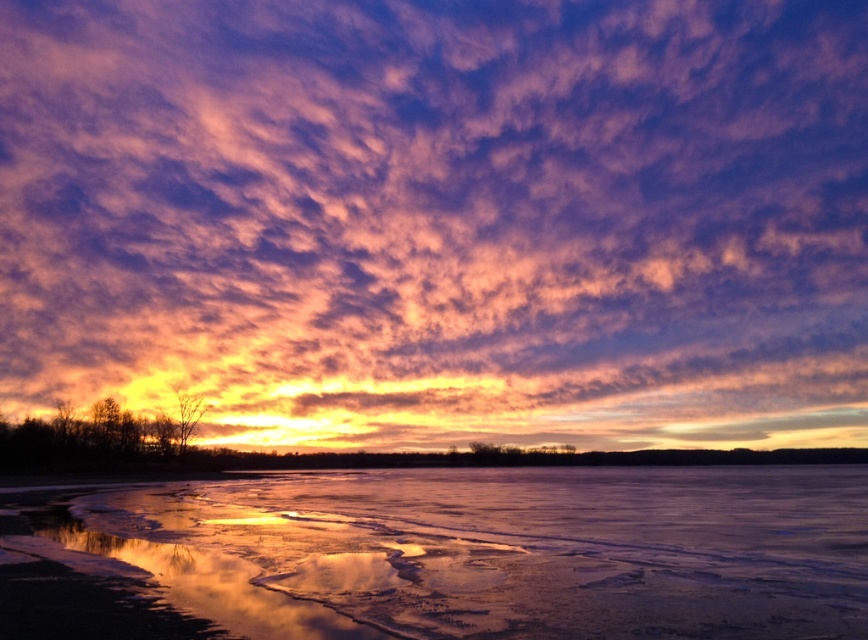
Is purple cotton clouds at upper center behind icy reflective water at lower center?

Yes, purple cotton clouds at upper center is further from the viewer.

Who is more forward, [860,394] or [603,554]?

Positioned in front is point [603,554].

This screenshot has height=640, width=868. Find the location of `purple cotton clouds at upper center`. purple cotton clouds at upper center is located at coordinates [x=439, y=218].